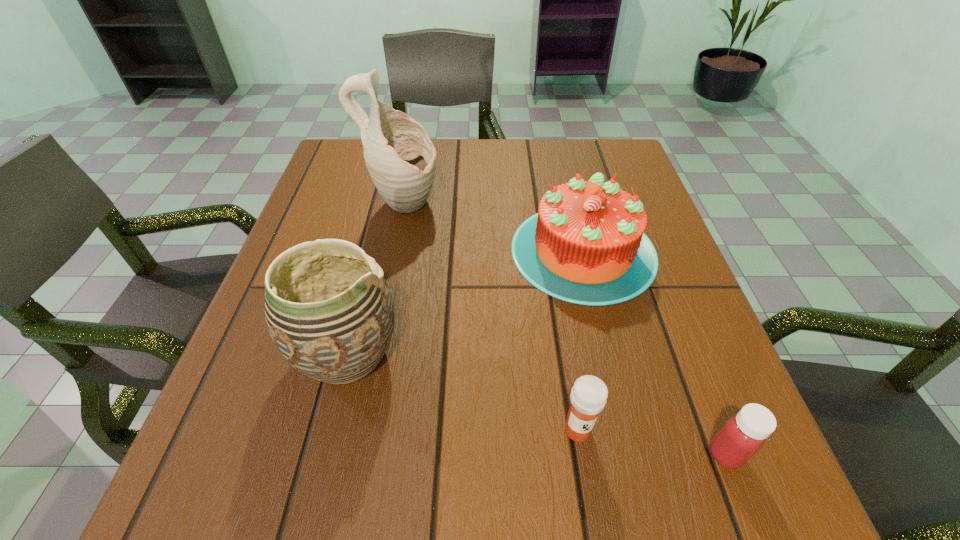
This screenshot has height=540, width=960. Identify the location of free region that satisfies the following two spatial constraints: 1. at the spout of the tallest object; 2. on the front side of the third nearest object. (373, 354).

Image resolution: width=960 pixels, height=540 pixels. In order to click on free space that satisfies the following two spatial constraints: 1. at the spout of the pitcher; 2. on the left side of the right medicine in this screenshot , I will do pos(353,454).

Locate an element on the screen. free space that satisfies the following two spatial constraints: 1. at the spout of the pitcher; 2. on the right side of the cake is located at coordinates (395, 251).

I want to click on free point that satisfies the following two spatial constraints: 1. at the spout of the pitcher; 2. on the back side of the third shortest object, so click(x=395, y=251).

The height and width of the screenshot is (540, 960). I want to click on vacant space that satisfies the following two spatial constraints: 1. on the back side of the third tallest object; 2. at the spout of the tallest object, so click(x=573, y=206).